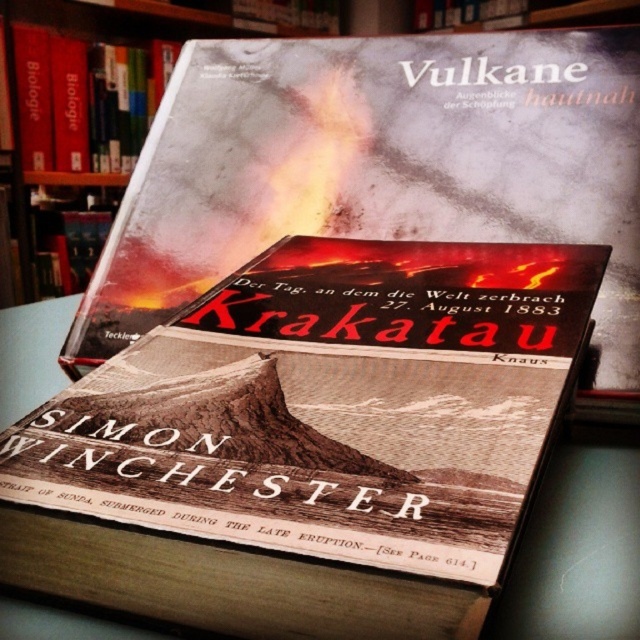
You are organizing a library and need to place both the matte paper book at center and the hardcover book at upper center on a shelf that can only accommodate one of them. Based on their sizes, which book should you choose to fit on the shelf?

The matte paper book at center is bigger than the hardcover book at upper center, so the hardcover book at upper center would fit on the shelf.